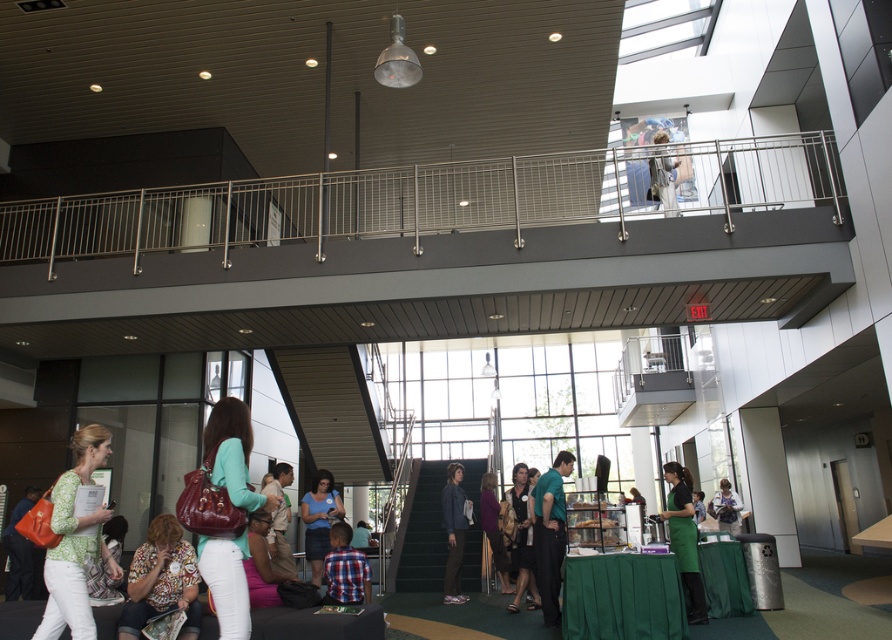
Is green matte shirt at center above matte green dress at lower right?

Yes, green matte shirt at center is above matte green dress at lower right.

Which is above, green matte shirt at center or matte green dress at lower right?

Positioned higher is green matte shirt at center.

You are a GUI agent. You are given a task and a screenshot of the screen. Output one action in this format:
    pyautogui.click(x=<x>, y=<y>)
    Task: Click on the green matte shirt at center
    This screenshot has height=640, width=892.
    Given the screenshot: What is the action you would take?
    pyautogui.click(x=550, y=532)

Where is `green matte shirt at center`? Image resolution: width=892 pixels, height=640 pixels. green matte shirt at center is located at coordinates (550, 532).

Measure the distance from matte black dress at center to green fabric shirt at center.

A distance of 2.77 meters exists between matte black dress at center and green fabric shirt at center.

Which is above, matte black dress at center or green fabric shirt at center?

green fabric shirt at center

The width and height of the screenshot is (892, 640). What do you see at coordinates (522, 538) in the screenshot?
I see `matte black dress at center` at bounding box center [522, 538].

Find the location of a particular element. matte black dress at center is located at coordinates (522, 538).

What do you see at coordinates (233, 452) in the screenshot? Image resolution: width=892 pixels, height=640 pixels. I see `matte brown purse at lower left` at bounding box center [233, 452].

Is matte brown purse at lower left below green fabric apron at lower center?

No, matte brown purse at lower left is not below green fabric apron at lower center.

Locate an element on the screen. The image size is (892, 640). matte brown purse at lower left is located at coordinates (233, 452).

This screenshot has width=892, height=640. In order to click on matte brown purse at lower left in this screenshot , I will do `click(233, 452)`.